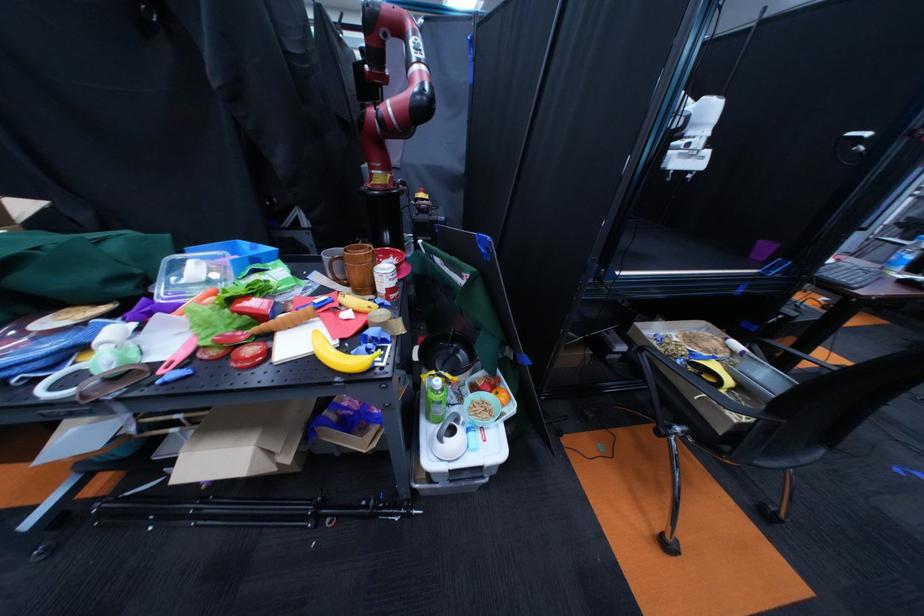
The image size is (924, 616). Identify the location of green bottle pump. (435, 398).